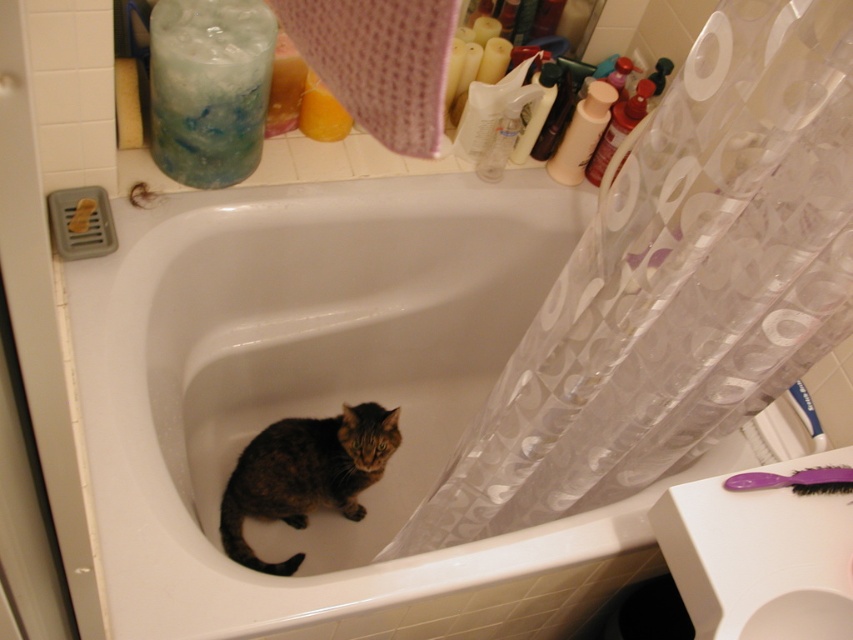
Question: Which point is closer to the camera?

Choices:
 (A) white glossy bathtub at center
 (B) clear plastic shower curtain at right
 (C) tabby fur cat at center

Answer: (B)

Question: Which of the following is the farthest from the observer?

Choices:
 (A) (306, 451)
 (B) (839, 269)
 (C) (328, 362)

Answer: (C)

Question: Is clear plastic shower curtain at right bigger than tabby fur cat at center?

Choices:
 (A) yes
 (B) no

Answer: (A)

Question: In this image, where is white glossy bathtub at center located relative to tabby fur cat at center?

Choices:
 (A) below
 (B) above

Answer: (B)

Question: Which object appears closest to the camera in this image?

Choices:
 (A) clear plastic shower curtain at right
 (B) tabby fur cat at center

Answer: (A)

Question: Is clear plastic shower curtain at right below tabby fur cat at center?

Choices:
 (A) yes
 (B) no

Answer: (B)